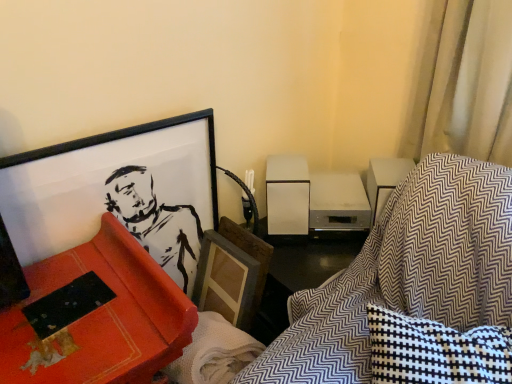
Question: Does textured fabric swivel chair at lower right appear on the right side of matte black picture frame at upper left?

Choices:
 (A) yes
 (B) no

Answer: (A)

Question: Is textured fabric swivel chair at lower right smaller than matte black picture frame at upper left?

Choices:
 (A) no
 (B) yes

Answer: (A)

Question: Is textured fabric swivel chair at lower right outside of matte black picture frame at upper left?

Choices:
 (A) no
 (B) yes

Answer: (B)

Question: Does textured fabric swivel chair at lower right come in front of matte black picture frame at upper left?

Choices:
 (A) no
 (B) yes

Answer: (B)

Question: Is textured fabric swivel chair at lower right far from matte black picture frame at upper left?

Choices:
 (A) yes
 (B) no

Answer: (B)

Question: Considering the relative sizes of textured fabric swivel chair at lower right and matte black picture frame at upper left in the image provided, is textured fabric swivel chair at lower right wider than matte black picture frame at upper left?

Choices:
 (A) no
 (B) yes

Answer: (B)

Question: Does matte red bookshelf at left contain matte black picture frame at upper left?

Choices:
 (A) no
 (B) yes

Answer: (A)

Question: Does matte red bookshelf at left touch matte black picture frame at upper left?

Choices:
 (A) yes
 (B) no

Answer: (B)

Question: Is matte red bookshelf at left to the left of matte black picture frame at upper left from the viewer's perspective?

Choices:
 (A) yes
 (B) no

Answer: (A)

Question: From a real-world perspective, is matte red bookshelf at left beneath matte black picture frame at upper left?

Choices:
 (A) no
 (B) yes

Answer: (B)

Question: Does matte red bookshelf at left have a lesser height compared to matte black picture frame at upper left?

Choices:
 (A) yes
 (B) no

Answer: (A)

Question: Considering the relative sizes of matte red bookshelf at left and matte black picture frame at upper left in the image provided, is matte red bookshelf at left smaller than matte black picture frame at upper left?

Choices:
 (A) no
 (B) yes

Answer: (A)

Question: Does matte black picture frame at upper left appear on the right side of textured fabric swivel chair at lower right?

Choices:
 (A) yes
 (B) no

Answer: (B)